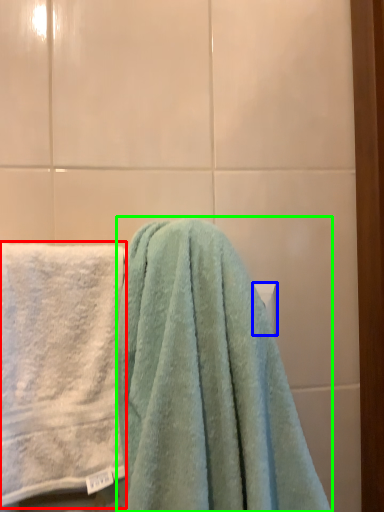
Question: Considering the real-world distances, which object is farthest from towel (highlighted by a red box)? towel bar (highlighted by a blue box) or towel (highlighted by a green box)?

Choices:
 (A) towel bar
 (B) towel

Answer: (A)